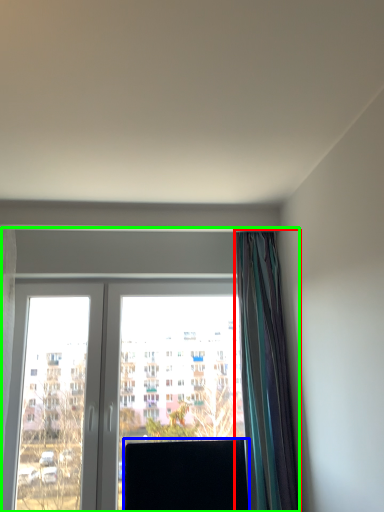
Question: Which is farther away from curtain (highlighted by a red box)? window screen (highlighted by a blue box) or window (highlighted by a green box)?

Choices:
 (A) window screen
 (B) window

Answer: (A)